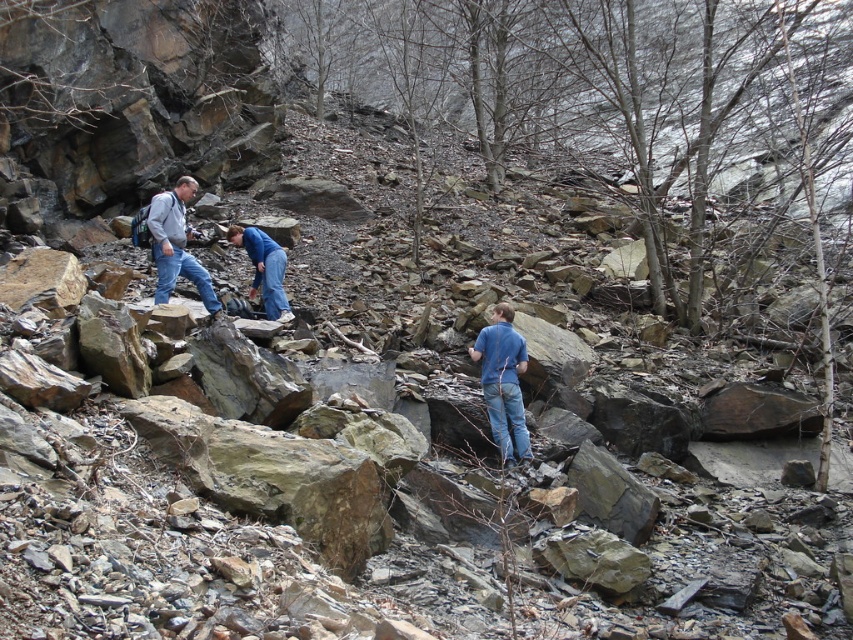
Looking at this image, you are planning to take a photo of the hikers in the rugged outdoor scene. The blue jeans at center and denim jacket at left are both in the frame. Which clothing item is closer to the camera?

The blue jeans at center is shorter than the denim jacket at left, so the blue jeans at center is closer to the camera.

You are a hiker trying to navigate through the rocky terrain in this mountainous area. You see a denim jacket at left and blue denim jeans at center. Can you walk between them without stepping on any rocks?

The distance between the denim jacket at left and blue denim jeans at center is 3.96 feet, which is sufficient to walk between them without stepping on rocks, assuming the path is clear.

You are standing at the point marked as point [503,381] in the image. What object are you currently standing on?

You are standing on the blue jeans at center.